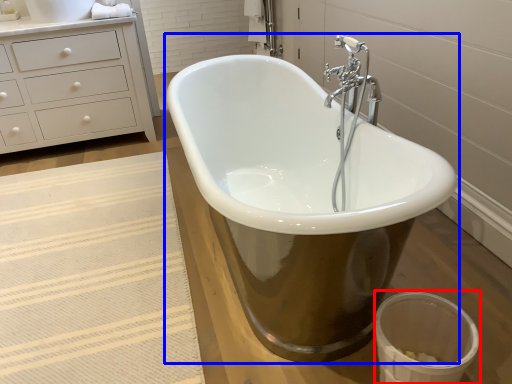
Question: Among these objects, which one is nearest to the camera, toilet bowl (highlighted by a red box) or bathtub (highlighted by a blue box)?

Choices:
 (A) toilet bowl
 (B) bathtub

Answer: (B)